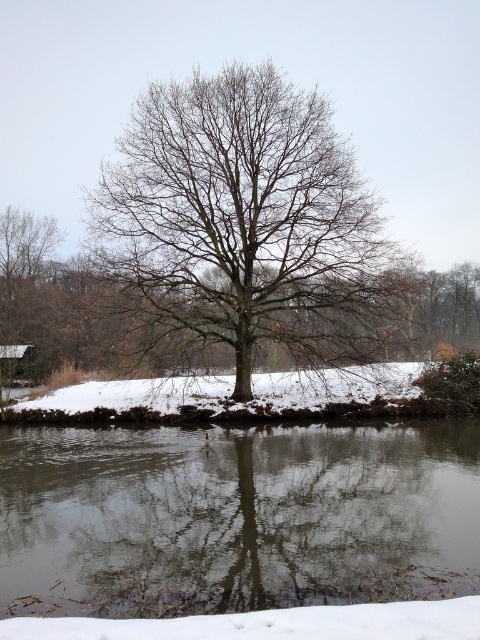
Question: Which point is closer to the camera?

Choices:
 (A) (235, 528)
 (B) (162, 209)

Answer: (A)

Question: Considering the relative positions of transparent ice at center and bare branches tree at center in the image provided, where is transparent ice at center located with respect to bare branches tree at center?

Choices:
 (A) left
 (B) right

Answer: (A)

Question: Which object appears closest to the camera in this image?

Choices:
 (A) bare branches tree at center
 (B) transparent ice at center

Answer: (B)

Question: Can you confirm if transparent ice at center is positioned to the right of bare branches tree at center?

Choices:
 (A) yes
 (B) no

Answer: (B)

Question: Does transparent ice at center have a larger size compared to bare branches tree at center?

Choices:
 (A) no
 (B) yes

Answer: (A)